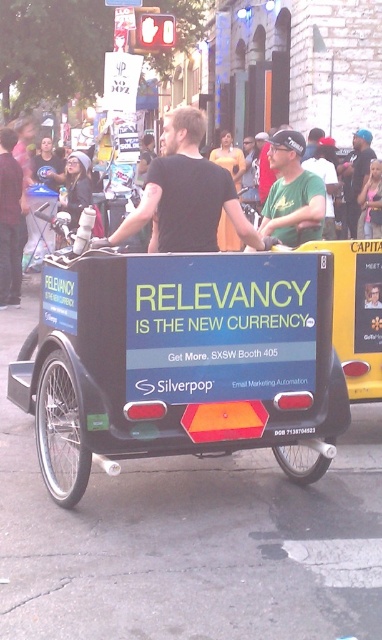
You are a fashion designer observing the two riders wearing the black matte shirt at center and the green matte shirt at center. Which rider is wearing their shirt higher up on the body?

The green matte shirt at center is higher up because the black matte shirt at center is located below it.